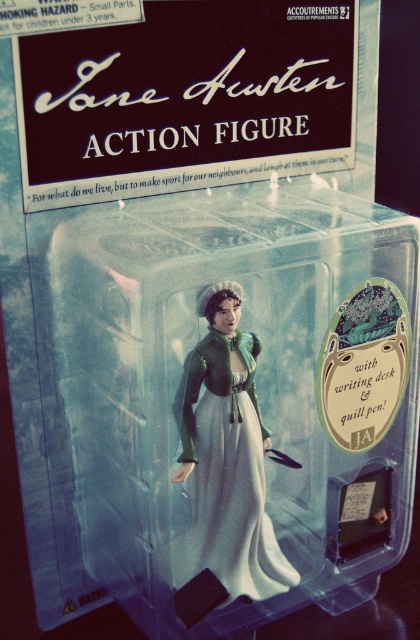
Looking at the Jane Austen action figure packaging, which object is larger between the transparent plastic action figure at center and the matte green fabric dress at center?

The transparent plastic action figure at center is bigger than the matte green fabric dress at center.

In the scene shown: What is the spatial relationship between the transparent plastic action figure at center and the matte green fabric dress at center?

The transparent plastic action figure at center is to the right of the matte green fabric dress at center.